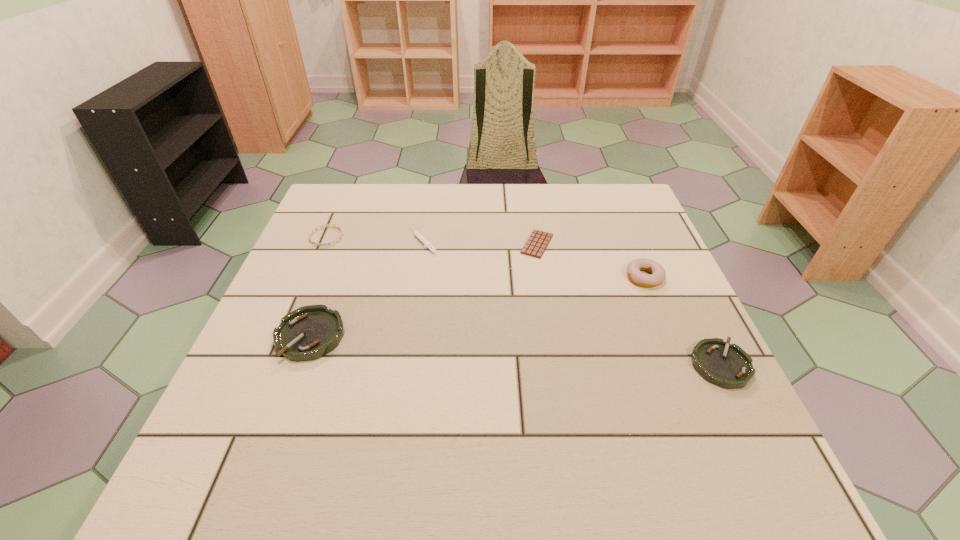
Identify the location of vacant region between the bracelet and the third nearest object. (486, 257).

In order to click on unoccupied area between the doughnut and the third object from left to right in this screenshot , I will do `click(534, 259)`.

Where is `vacant region between the candy bar and the left ashtray`? This screenshot has height=540, width=960. vacant region between the candy bar and the left ashtray is located at coordinates (423, 290).

At what (x,y) coordinates should I click in order to perform the action: click on unoccupied area between the syringe and the left ashtray. Please return your answer as a coordinate pair (x, y). Looking at the image, I should click on (367, 288).

I want to click on free space between the taller ashtray and the third object from left to right, so click(x=367, y=288).

The width and height of the screenshot is (960, 540). I want to click on vacant space that is in between the taller ashtray and the right ashtray, so click(x=516, y=350).

The width and height of the screenshot is (960, 540). Find the location of `blank region between the candy bar and the doughnut`. blank region between the candy bar and the doughnut is located at coordinates (590, 261).

Identify which object is the second nearest to the fourth farthest object. Please provide its 2D coordinates. Your answer should be formatted as a tuple, i.e. [(x, y)], where the tuple contains the x and y coordinates of a point satisfying the conditions above.

[(726, 365)]

Choose which object is the fifth nearest neighbor to the doughnut. Please provide its 2D coordinates. Your answer should be formatted as a tuple, i.e. [(x, y)], where the tuple contains the x and y coordinates of a point satisfying the conditions above.

[(335, 225)]

The image size is (960, 540). Find the location of `free region that satisfies the following two spatial constraints: 1. on the surface of the third nearest object showing star-shaped elements; 2. on the left side of the bracelet`. free region that satisfies the following two spatial constraints: 1. on the surface of the third nearest object showing star-shaped elements; 2. on the left side of the bracelet is located at coordinates (309, 277).